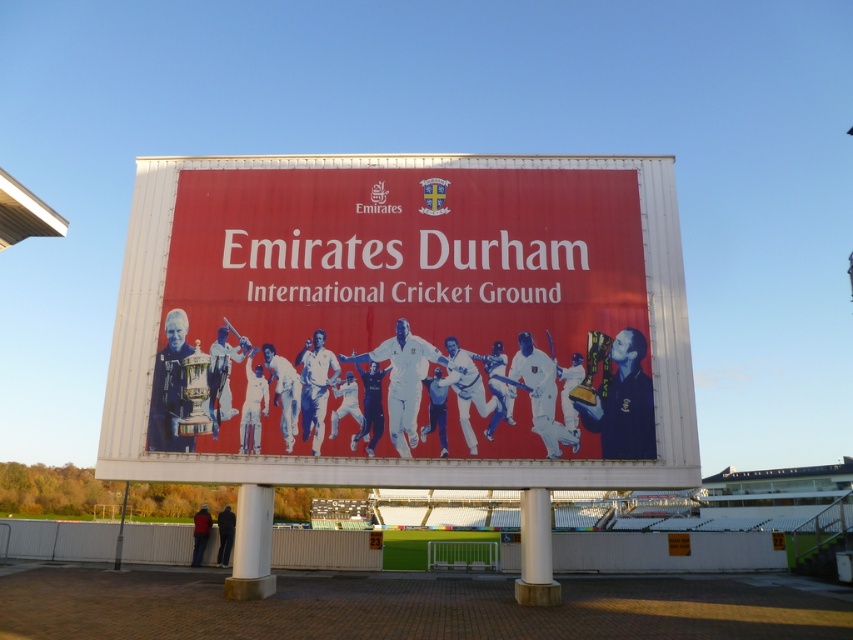
Question: Which of the following is the farthest from the observer?

Choices:
 (A) (175, 276)
 (B) (238, 506)
 (C) (518, 579)

Answer: (C)

Question: Among these objects, which one is nearest to the camera?

Choices:
 (A) matte red poster at center
 (B) white concrete pillar at center
 (C) white polished concrete pillar at center

Answer: (C)

Question: From the image, what is the correct spatial relationship of matte red poster at center in relation to white concrete pillar at center?

Choices:
 (A) right
 (B) left

Answer: (A)

Question: Which object appears farthest from the camera in this image?

Choices:
 (A) white concrete pillar at center
 (B) matte red poster at center
 (C) white polished concrete pillar at center

Answer: (B)

Question: Is white concrete pillar at center positioned in front of white polished concrete pillar at center?

Choices:
 (A) no
 (B) yes

Answer: (A)

Question: From the image, what is the correct spatial relationship of matte red poster at center in relation to white polished concrete pillar at center?

Choices:
 (A) right
 (B) left

Answer: (B)